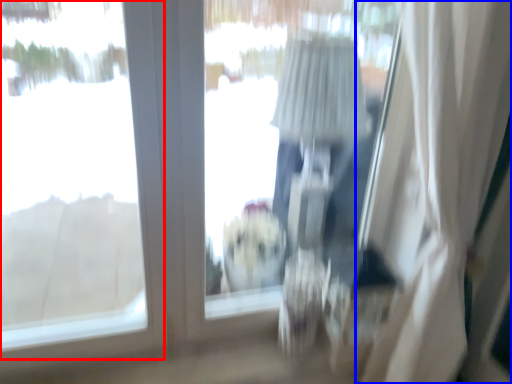
Question: Which object appears closest to the camera in this image, window (highlighted by a red box) or curtain (highlighted by a blue box)?

Choices:
 (A) window
 (B) curtain

Answer: (B)